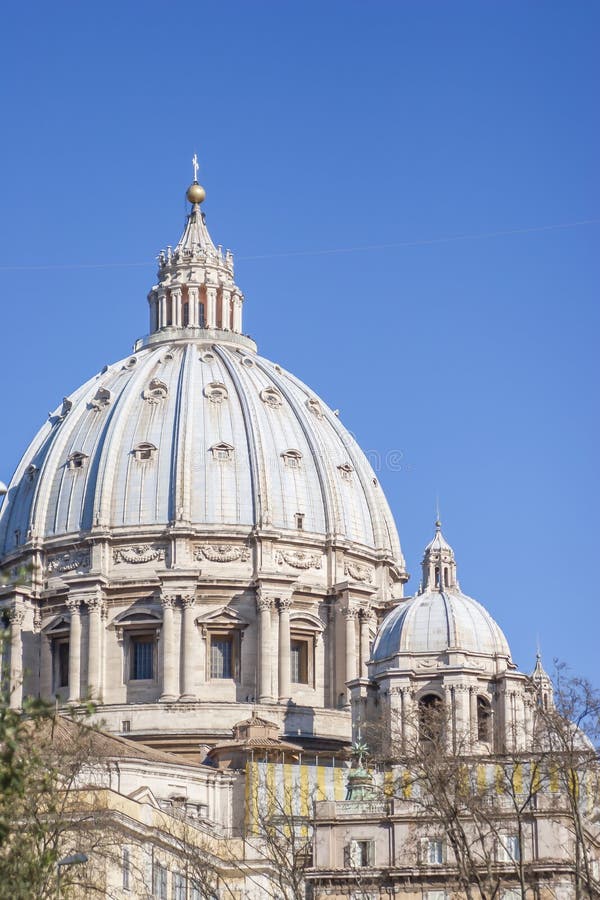
Identify the location of 6 windows. (475, 702).